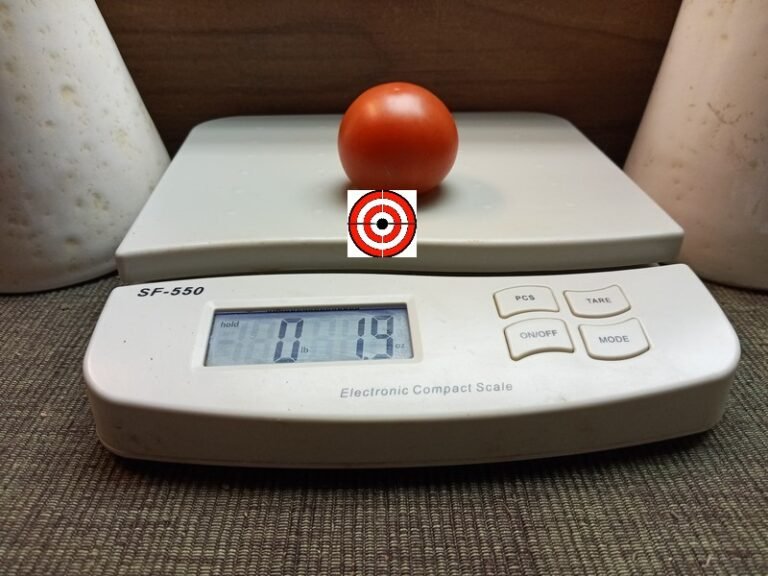
This screenshot has width=768, height=576. What are the coordinates of `tan wood background` in the screenshot? It's located at (626, 75).